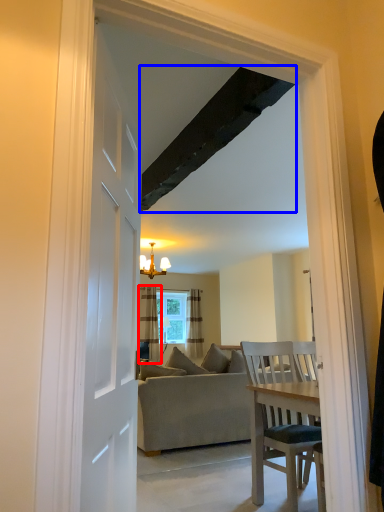
Question: Which object is closer to the camera taking this photo, curtain (highlighted by a red box) or exhaust hood (highlighted by a blue box)?

Choices:
 (A) curtain
 (B) exhaust hood

Answer: (B)